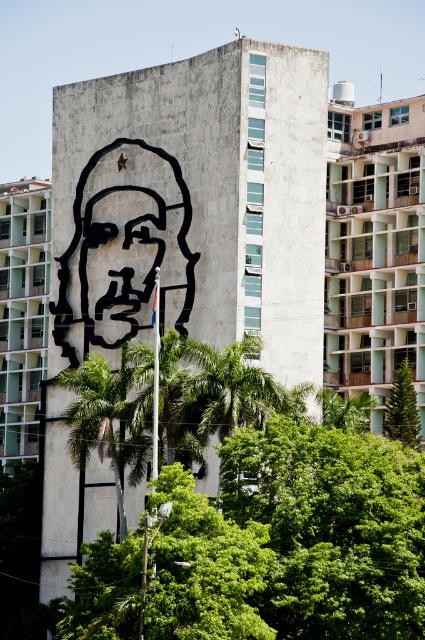
Where is `black matte face at center`? This screenshot has width=425, height=640. black matte face at center is located at coordinates 122,268.

Describe the element at coordinates (122, 268) in the screenshot. I see `black matte face at center` at that location.

Image resolution: width=425 pixels, height=640 pixels. I want to click on black matte face at center, so click(122, 268).

At what (x,y) coordinates should I click in order to perform the action: click on black matte portrait at center. Please return your answer as a coordinate pair (x, y). Looking at the image, I should click on (122, 248).

Between black matte portrait at center and black matte face at center, which one appears on the left side from the viewer's perspective?

Positioned to the left is black matte face at center.

Who is more distant from viewer, (x=146, y=284) or (x=130, y=237)?

Point (x=130, y=237)

Where is `black matte portrait at center`? Image resolution: width=425 pixels, height=640 pixels. black matte portrait at center is located at coordinates (122, 248).

Can you confirm if black matte portrait at center is positioned to the left of green leafy tree at center?

Indeed, black matte portrait at center is positioned on the left side of green leafy tree at center.

Does black matte portrait at center have a smaller size compared to green leafy tree at center?

No, black matte portrait at center is not smaller than green leafy tree at center.

What do you see at coordinates (122, 248) in the screenshot? The image size is (425, 640). I see `black matte portrait at center` at bounding box center [122, 248].

Locate an element on the screen. black matte portrait at center is located at coordinates (122, 248).